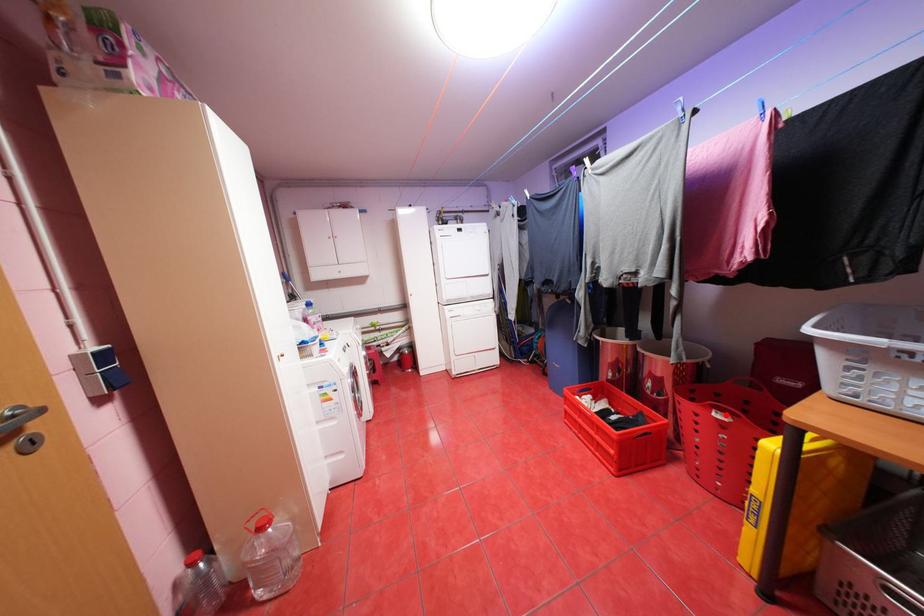
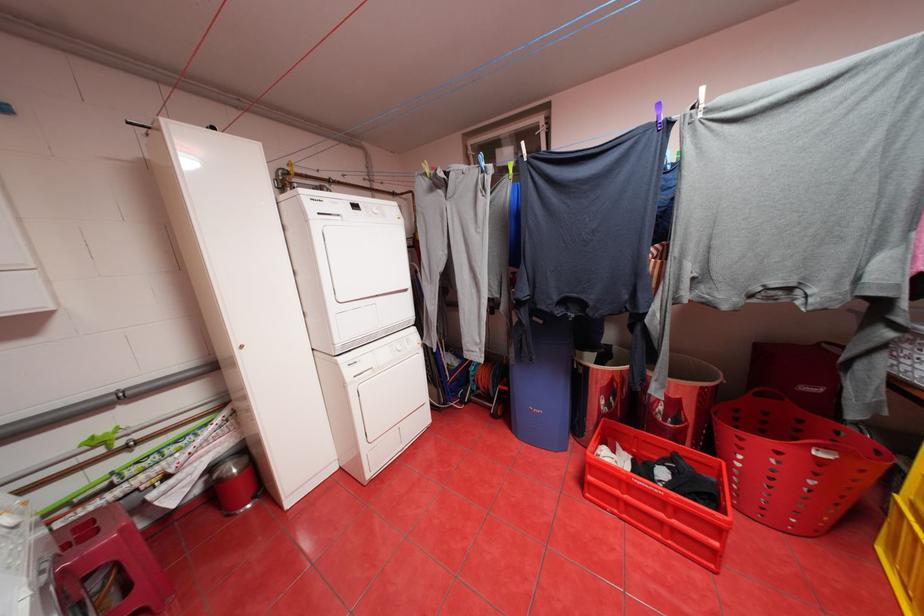
Question: I am providing you with two images of the same scene from different viewpoints. Image1 has a red point marked. In image2, the corresponding 3D location appears at what relative position? Reply with the corresponding letter.

Choices:
 (A) Closer
 (B) Farther

Answer: (A)